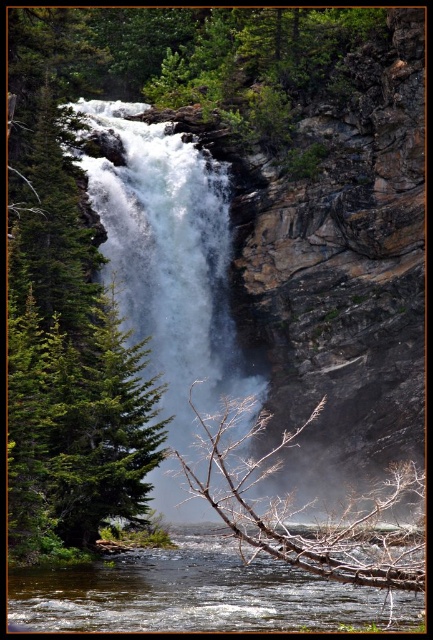
You are standing at the base of the waterfall and want to take a photo of the white frothy water at center and the clear water at center. Which one appears closer to you in the image?

The white frothy water at center appears closer to you because it is further to the viewer than the clear water at center.